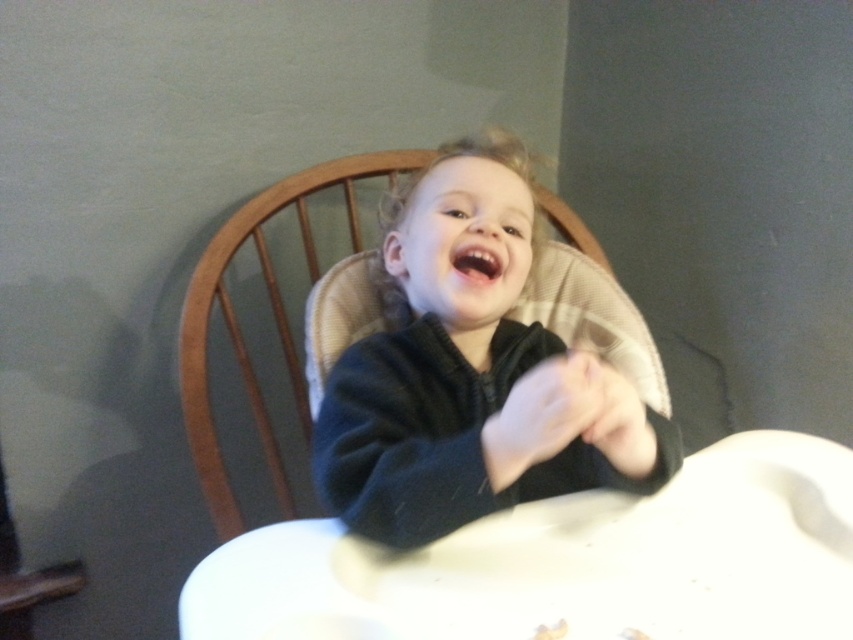
You are a photographer setting up for a photo shoot. You notice the white matte hand at center and the matte black hand at center in the scene. Which hand should you focus on to ensure it appears clearer in the final photo?

The white matte hand at center is closer to the viewer than the matte black hand at center, so focusing on the white matte hand at center will ensure it appears clearer in the final photo.

You are a photographer setting up a shot of the child in the high chair. You need to ensure that the dark blue fleece at center and the matte black hand at center are positioned so they don not overlap in the final image. Given their current distance, will they overlap?

The dark blue fleece at center and the matte black hand at center are 7.71 inches apart, so they will not overlap in the final image.